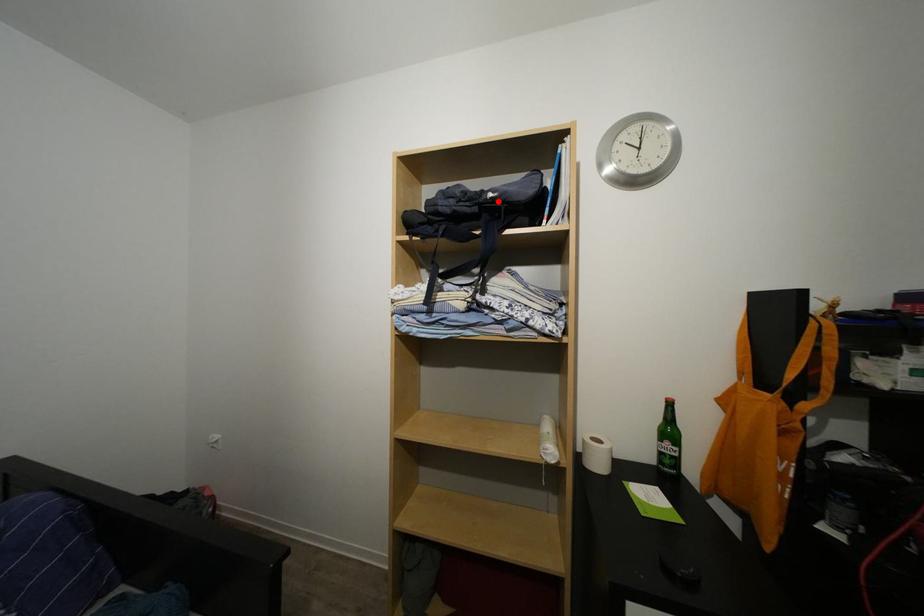
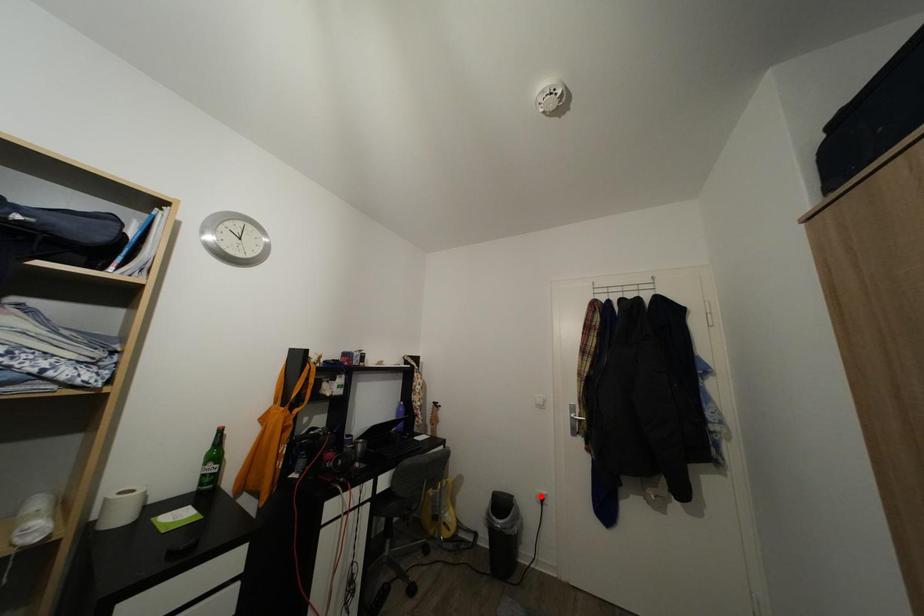
I am providing you with two images of the same scene from different viewpoints. A red point is marked on the first image and another point is marked on the second image. Is the red point in image1 aligned with the point shown in image2?

No